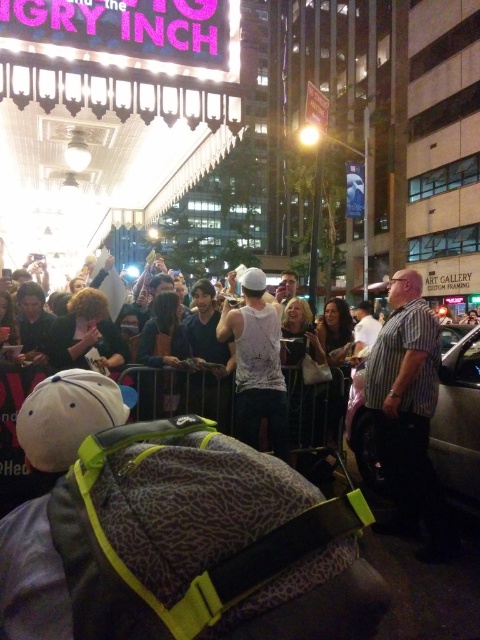
Which is behind, point (433, 445) or point (288, 451)?

Positioned behind is point (288, 451).

In order to click on silver metallic car at center-right in this screenshot , I will do `click(457, 417)`.

Is point (455, 476) positioned behind point (252, 272)?

No, it is in front of (252, 272).

At what (x,y) coordinates should I click in order to perform the action: click on silver metallic car at center-right. Please return your answer as a coordinate pair (x, y). This screenshot has height=640, width=480. Looking at the image, I should click on (457, 417).

Is striped cotton shirt at center positioned before silver metallic car at center-right?

That is True.

Can you confirm if striped cotton shirt at center is wider than silver metallic car at center-right?

No.

At what (x,y) coordinates should I click in order to perform the action: click on striped cotton shirt at center. Please return your answer as a coordinate pair (x, y). This screenshot has height=640, width=480. Looking at the image, I should click on (408, 412).

Locate an element on the screen. The height and width of the screenshot is (640, 480). striped cotton shirt at center is located at coordinates (408, 412).

Is striped cotton shirt at center positioned in front of white cotton tank top at center?

Yes, striped cotton shirt at center is closer to the viewer.

In the scene shown: Who is shorter, striped cotton shirt at center or white cotton tank top at center?

Standing shorter between the two is white cotton tank top at center.

Identify the location of striped cotton shirt at center. (408, 412).